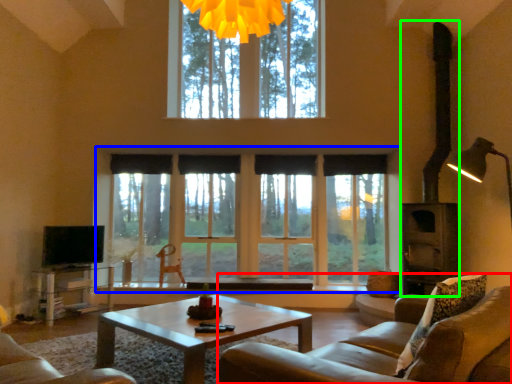
Question: Estimate the real-world distances between objects in this image. Which object is farther from studio couch (highlighted by a red box), window (highlighted by a blue box) or fireplace (highlighted by a green box)?

Choices:
 (A) window
 (B) fireplace

Answer: (A)